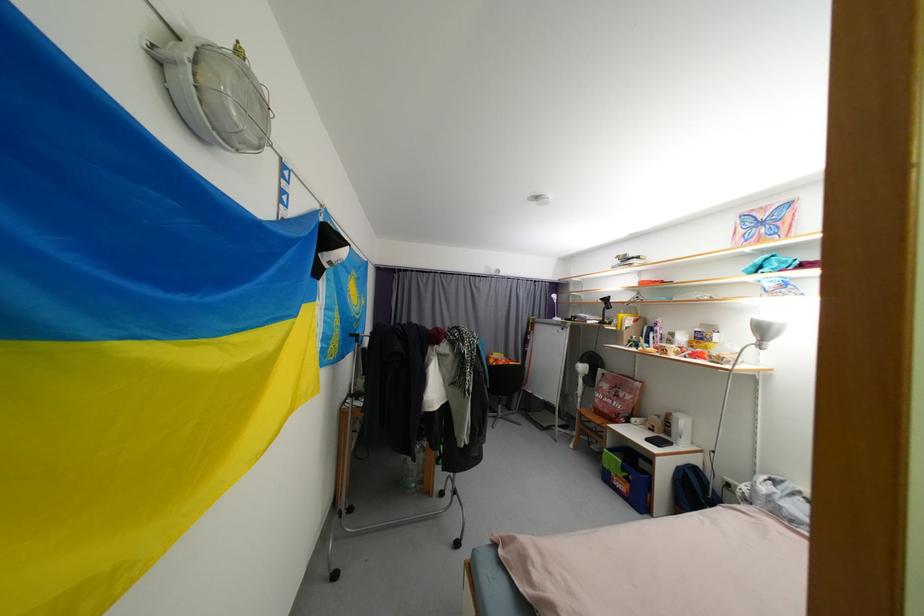
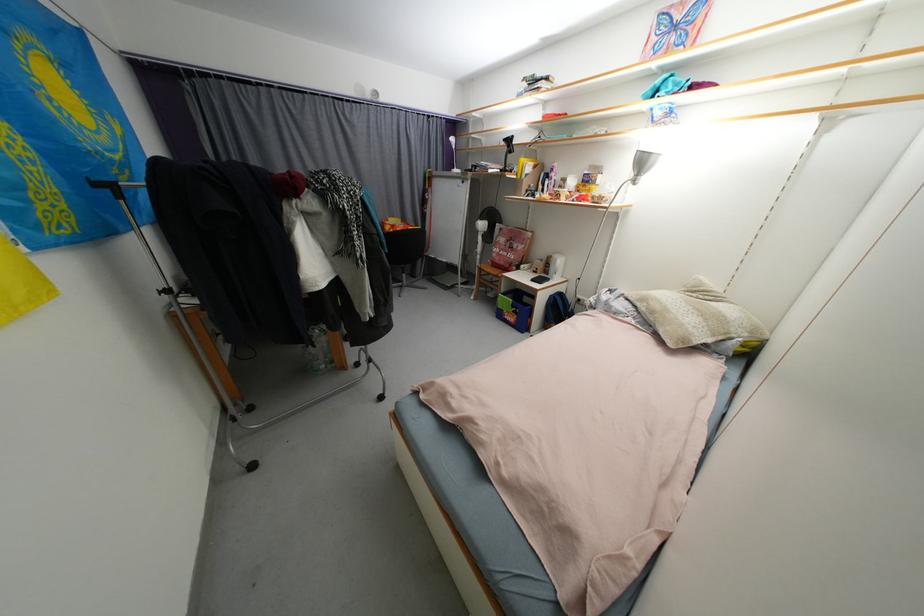
Where in the second image is the point corresponding to point 419,487 from the first image?

(329, 368)